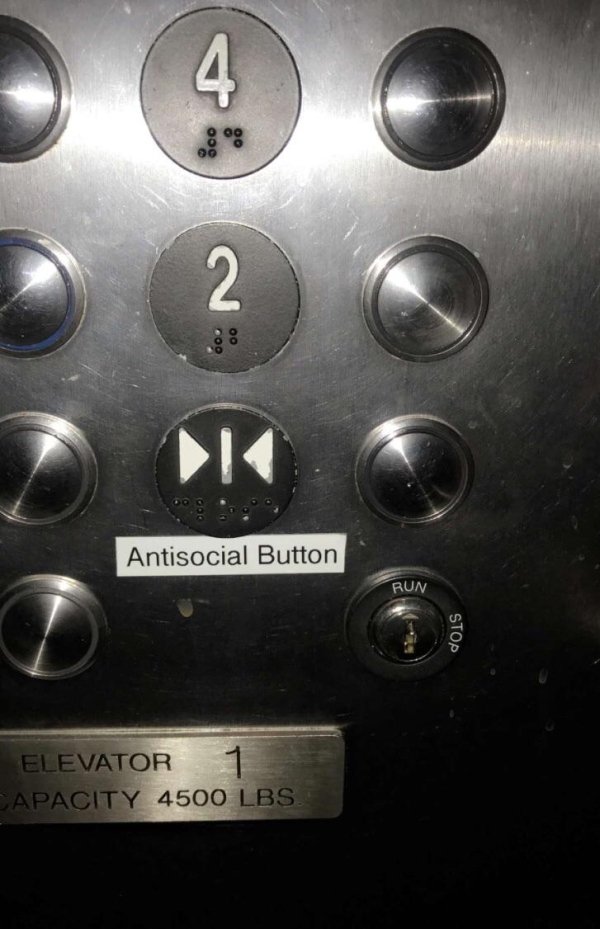
Locate an element on the screen. This screenshot has width=600, height=929. placard is located at coordinates (303, 749).